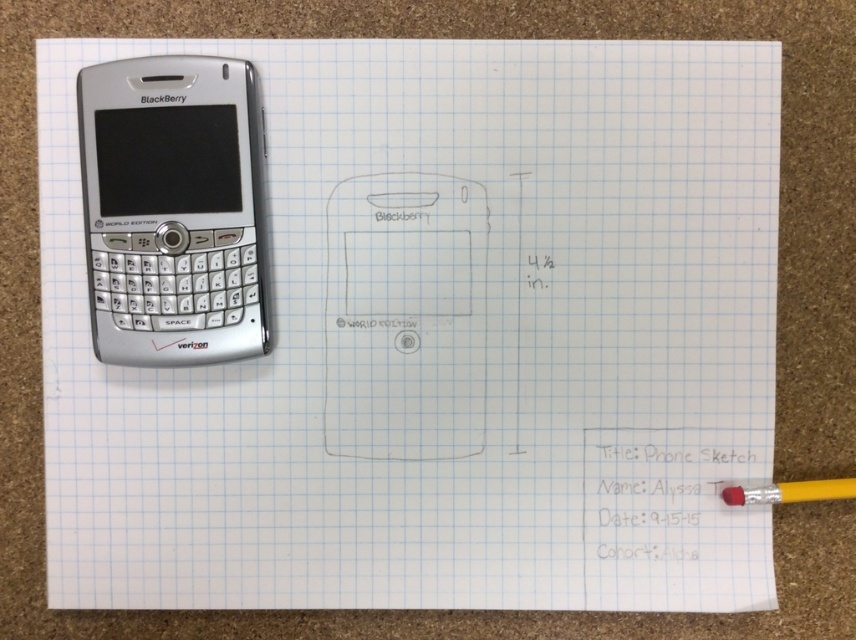
Is red rubber eraser at bottom right to the left of rubber eraser at lower right from the viewer's perspective?

In fact, red rubber eraser at bottom right is to the right of rubber eraser at lower right.

Is red rubber eraser at bottom right smaller than rubber eraser at lower right?

No.

What do you see at coordinates (789, 492) in the screenshot? This screenshot has height=640, width=856. I see `red rubber eraser at bottom right` at bounding box center [789, 492].

At what (x,y) coordinates should I click in order to perform the action: click on red rubber eraser at bottom right. Please return your answer as a coordinate pair (x, y). The width and height of the screenshot is (856, 640). Looking at the image, I should click on (789, 492).

Is point (241, 164) behind point (724, 502)?

That is False.

Between point (96, 308) and point (730, 486), which one is positioned behind?

The point (730, 486) is behind.

I want to click on silver metallic blackberry at upper left, so click(174, 209).

Is point (177, 138) farther from camera compared to point (770, 502)?

No, (177, 138) is in front of (770, 502).

Find the location of a particular element. Image resolution: width=856 pixels, height=640 pixels. silver metallic blackberry at upper left is located at coordinates (174, 209).